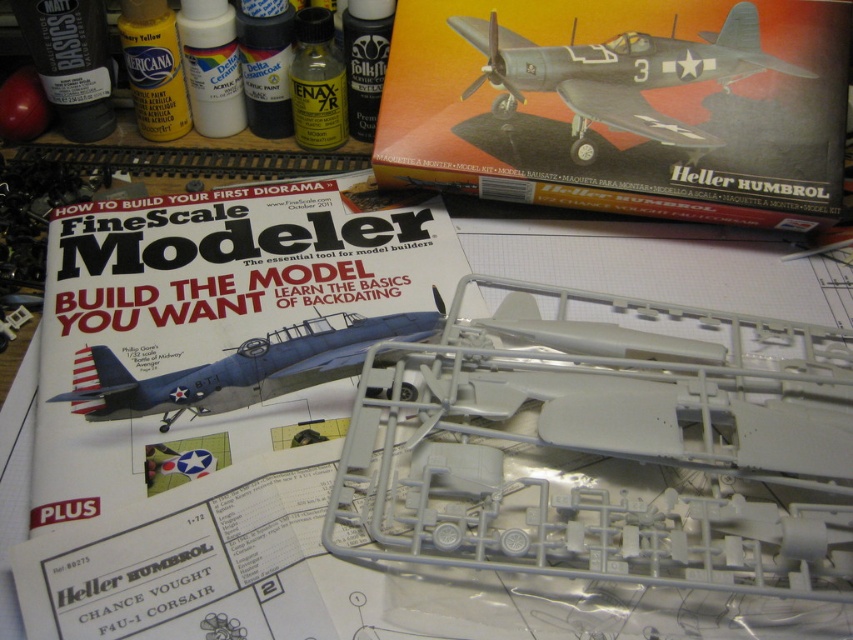
Can you confirm if matte gray airplane at upper center is thinner than blue matte airplane at center?

Incorrect, matte gray airplane at upper center's width is not less than blue matte airplane at center's.

Is point (521, 83) farther from camera compared to point (225, 397)?

Yes, it is behind point (225, 397).

Does point (556, 88) come farther from viewer compared to point (260, 348)?

Yes, it is.

The height and width of the screenshot is (640, 853). I want to click on matte gray airplane at upper center, so click(x=619, y=76).

Can you confirm if white plastic airplane at center is positioned below blue matte airplane at center?

Yes.

Is point (482, 428) positioned behind point (305, 387)?

That is False.

Who is more forward, (759, 372) or (318, 317)?

Point (759, 372) is more forward.

Where is `white plastic airplane at center`? This screenshot has height=640, width=853. white plastic airplane at center is located at coordinates (606, 449).

What do you see at coordinates (606, 449) in the screenshot?
I see `white plastic airplane at center` at bounding box center [606, 449].

This screenshot has height=640, width=853. I want to click on white plastic airplane at center, so click(606, 449).

The width and height of the screenshot is (853, 640). Find the location of `white plastic airplane at center`. white plastic airplane at center is located at coordinates (606, 449).